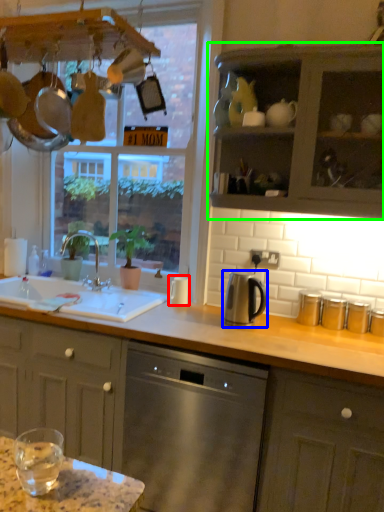
Question: Which object is positioned closest to appliance (highlighted by a red box)? Select from kitchen appliance (highlighted by a blue box) and cabinetry (highlighted by a green box).

Choices:
 (A) kitchen appliance
 (B) cabinetry

Answer: (A)